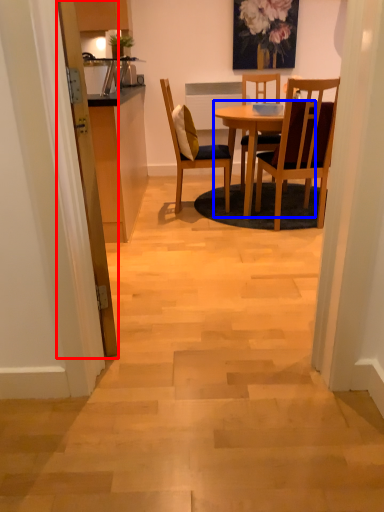
Question: Which point is closer to the camera, door (highlighted by a red box) or round table (highlighted by a blue box)?

Choices:
 (A) door
 (B) round table

Answer: (A)